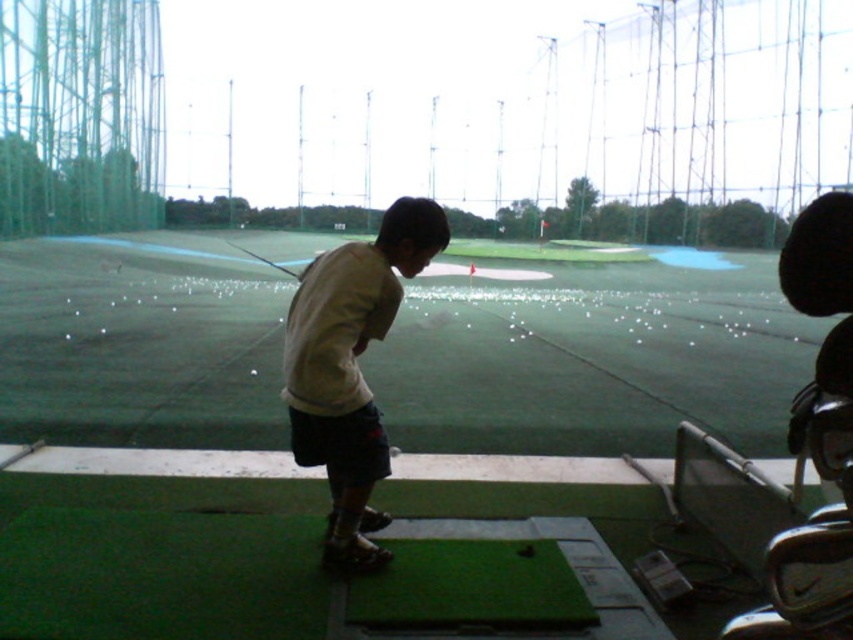
You are a golfer standing at the point labeled as point (96, 260) on the driving range. You want to hit a golf ball to the flag located 10 meters away from the camera. Can you reach the flag from your current position?

The distance between point (96, 260) and the camera is 15.25 meters. Since the flag is 10 meters away from the camera, the golfer at point (96, 260) is farther from the camera than the flag. Therefore, the golfer can reach the flag as it is closer to the camera than their position.

You are a golfer standing at the driving range. You want to hit a ball towards the green artificial turf at center. However, there is a person wearing a light beige shirt at center in your path. Can you safely hit the ball towards the target without hitting the person?

The light beige shirt at center is behind the green artificial turf at center, so the person is not in the direct path of the ball. You can safely hit the ball towards the green artificial turf at center without hitting the person.